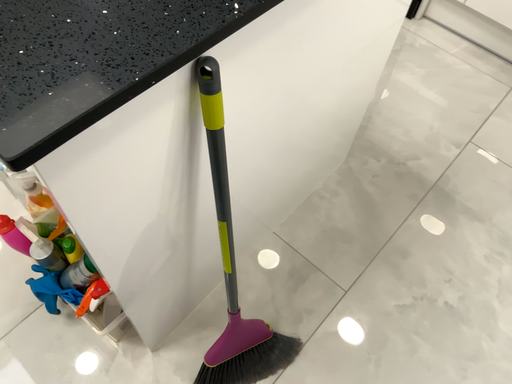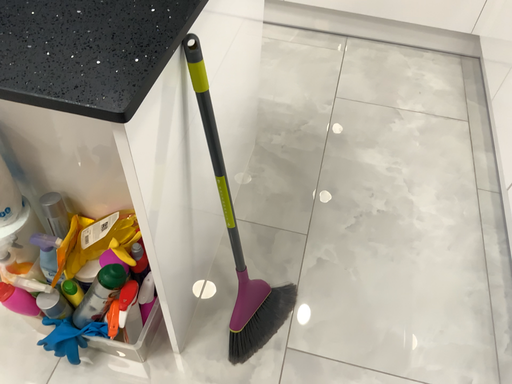
Question: How did the camera likely rotate when shooting the video?

Choices:
 (A) rotated downward
 (B) rotated upward

Answer: (B)